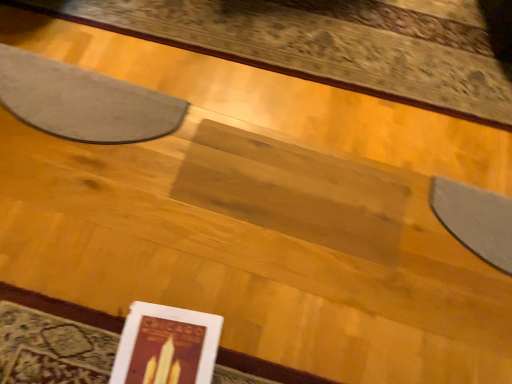
This screenshot has height=384, width=512. Find the location of `empty space that is ontop of matte paper book at lower left (from a real-world perspective)`. empty space that is ontop of matte paper book at lower left (from a real-world perspective) is located at coordinates [x=166, y=352].